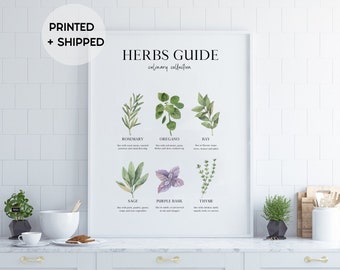
At what (x,y) coordinates should I click in order to perform the action: click on wall. Please return your answer as a coordinate pair (x, y). The width and height of the screenshot is (340, 270). Looking at the image, I should click on (299, 74).